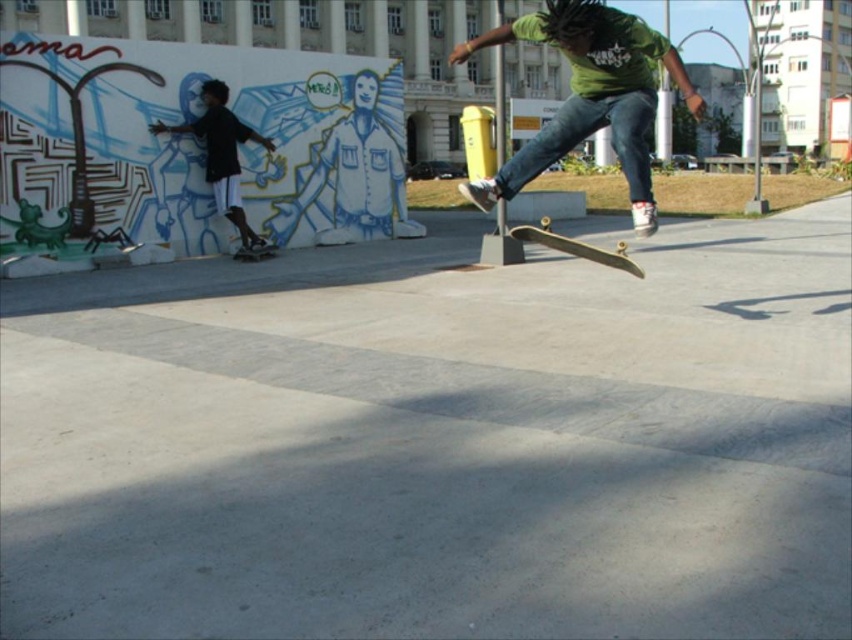
Question: Is wooden skateboard at center positioned at the back of wooden skateboard at lower left?

Choices:
 (A) yes
 (B) no

Answer: (B)

Question: Where is green matte skateboard at center located in relation to wooden skateboard at lower left in the image?

Choices:
 (A) above
 (B) below

Answer: (A)

Question: Which point is closer to the camera?

Choices:
 (A) (222, 211)
 (B) (695, 112)
 (C) (566, 250)
 (D) (266, 243)

Answer: (B)

Question: Which of the following is the closest to the observer?

Choices:
 (A) green matte skateboard at center
 (B) black matte clothing at left

Answer: (A)

Question: Estimate the real-world distances between objects in this image. Which object is closer to the green matte skateboard at center?

Choices:
 (A) wooden skateboard at center
 (B) wooden skateboard at lower left

Answer: (A)

Question: Can you confirm if black matte clothing at left is positioned below wooden skateboard at center?

Choices:
 (A) yes
 (B) no

Answer: (B)